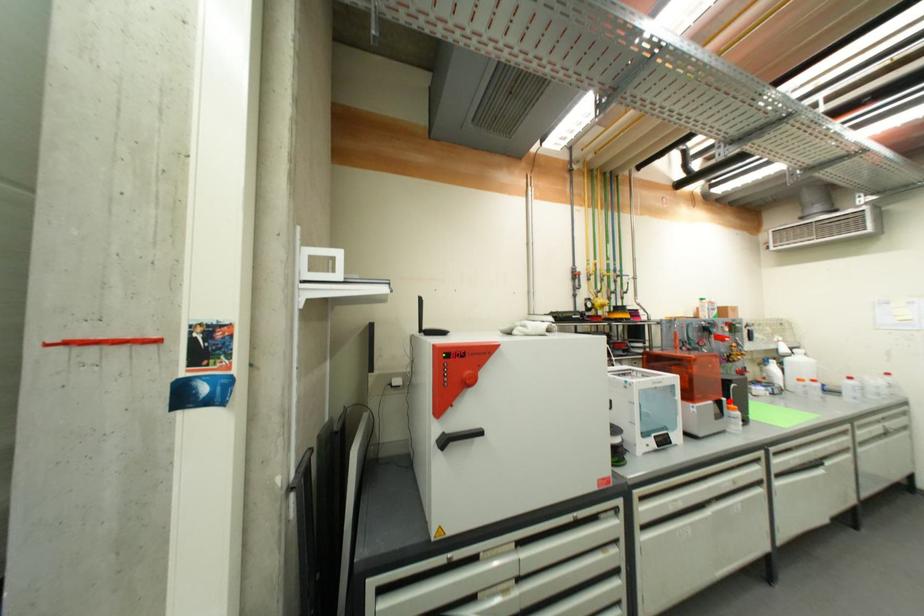
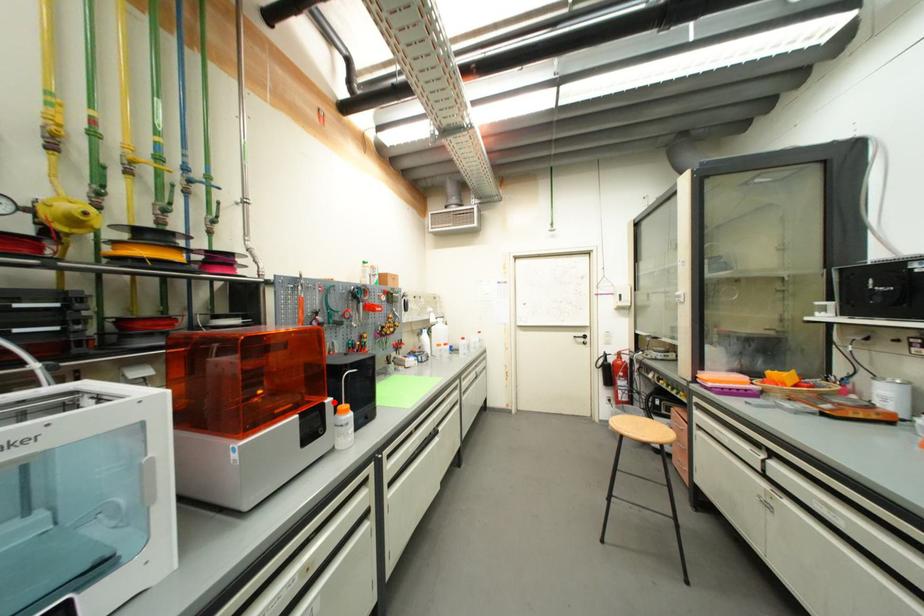
In the scene shown: I am providing you with two images of the same scene from different viewpoints. A red point is marked on the first image and another point is marked on the second image. Are the points marked in image1 and image2 representing the same 3D position?

Result: Yes